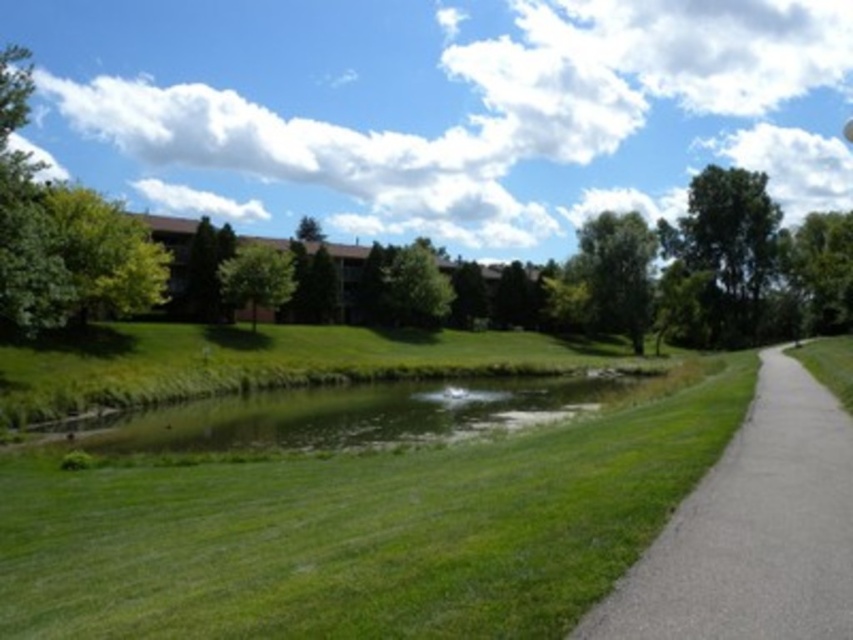
You are planning to walk from the gray asphalt path at right to the green grassy pond at center. Which of the two has a larger area according to the scene description?

The green grassy pond at center has a larger area than the gray asphalt path at right.

Looking at this image, you are planning to walk from the gray asphalt path at right to the green grassy pond at center. Which path has a narrower width?

The gray asphalt path at right is thinner than the green grassy pond at center, so the gray asphalt path at right has a narrower width.

You are standing in the outdoor scene and want to determine which of the two points, point (x=695, y=538) or point (x=608, y=385), is closer to you. Based on the scene description, which point is nearer?

Point (x=695, y=538) is closer to the camera than point (x=608, y=385), so it is the nearer one.